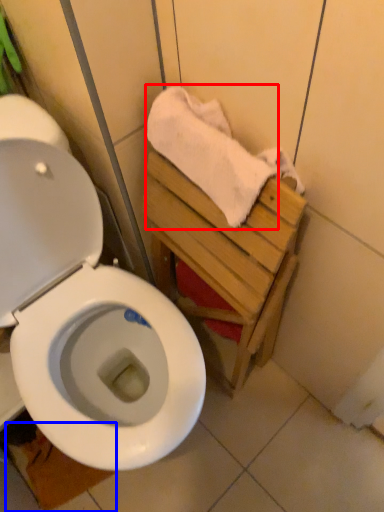
Question: Which object appears farthest to the camera in this image, bath towel (highlighted by a red box) or tile (highlighted by a blue box)?

Choices:
 (A) bath towel
 (B) tile

Answer: (B)